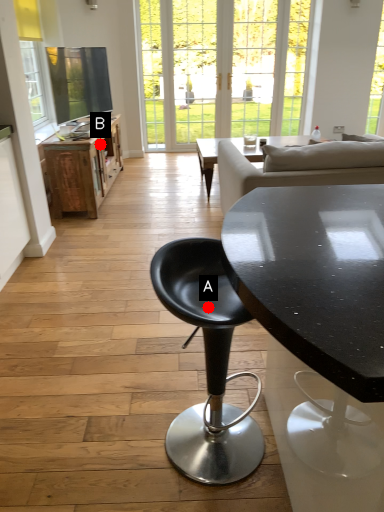
Question: Two points are circled on the image, labeled by A and B beside each circle. Which point is closer to the camera?

Choices:
 (A) A is closer
 (B) B is closer

Answer: (A)